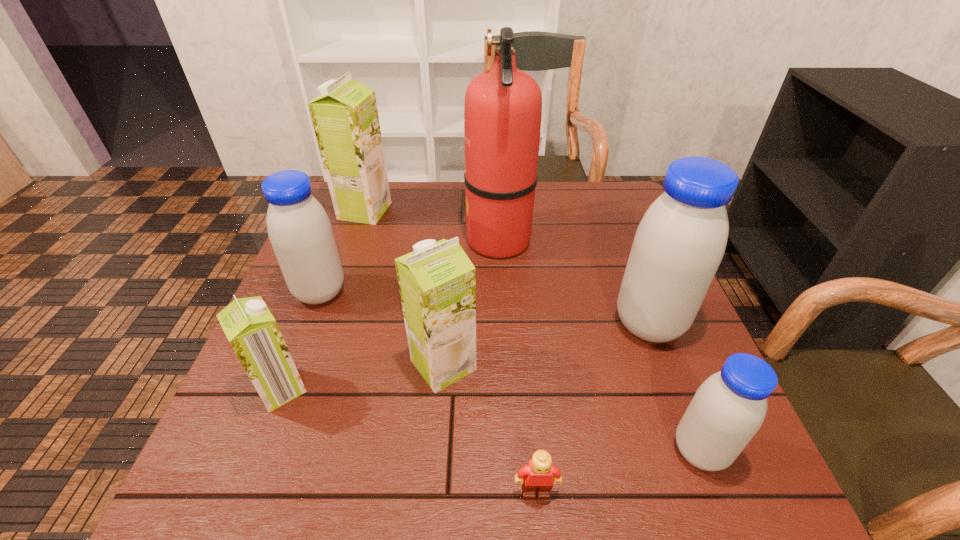
Locate which object is the closest to the second smallest blue soya milk. Please provide its 2D coordinates. Your answer should be formatted as a tuple, i.e. [(x, y)], where the tuple contains the x and y coordinates of a point satisfying the conditions above.

[(251, 329)]

Locate which soya milk ranks third in proximity to the shortest object. Please provide its 2D coordinates. Your answer should be formatted as a tuple, i.e. [(x, y)], where the tuple contains the x and y coordinates of a point satisfying the conditions above.

[(680, 242)]

Select which soya milk appears as the third closest to the biggest blue soya milk. Please provide its 2D coordinates. Your answer should be formatted as a tuple, i.e. [(x, y)], where the tuple contains the x and y coordinates of a point satisfying the conditions above.

[(300, 232)]

Point out which green soya milk is positioned as the third nearest to the second biggest blue soya milk. Please provide its 2D coordinates. Your answer should be formatted as a tuple, i.e. [(x, y)], where the tuple contains the x and y coordinates of a point satisfying the conditions above.

[(345, 118)]

I want to click on green soya milk object that ranks as the second closest to the smallest green soya milk, so click(345, 118).

Locate an element on the screen. the closest blue soya milk to the smallest green soya milk is located at coordinates (300, 232).

Identify the location of blue soya milk that stands as the closest to the second biggest blue soya milk. Image resolution: width=960 pixels, height=540 pixels. (x=680, y=242).

Identify the location of vacant space that satisfies the following two spatial constraints: 1. on the front side of the nearest blue soya milk; 2. on the left side of the leftmost blue soya milk. This screenshot has width=960, height=540. (259, 451).

Where is `vacant region that satisfies the following two spatial constraints: 1. on the front side of the biggest blue soya milk; 2. on the right side of the biggest green soya milk`? vacant region that satisfies the following two spatial constraints: 1. on the front side of the biggest blue soya milk; 2. on the right side of the biggest green soya milk is located at coordinates (325, 324).

Locate an element on the screen. vacant area that satisfies the following two spatial constraints: 1. on the back side of the smallest green soya milk; 2. on the left side of the second biggest green soya milk is located at coordinates click(291, 365).